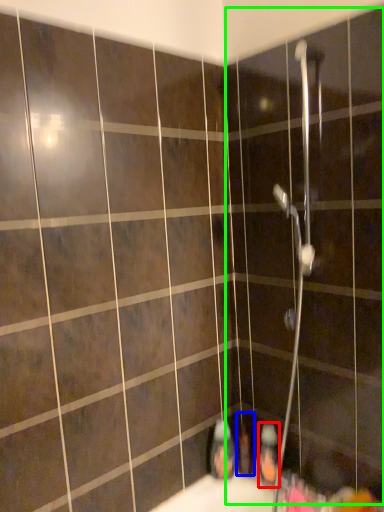
Question: Considering the real-world distances, which object is farthest from toiletry (highlighted by a red box)? toiletry (highlighted by a blue box) or screen door (highlighted by a green box)?

Choices:
 (A) toiletry
 (B) screen door

Answer: (B)